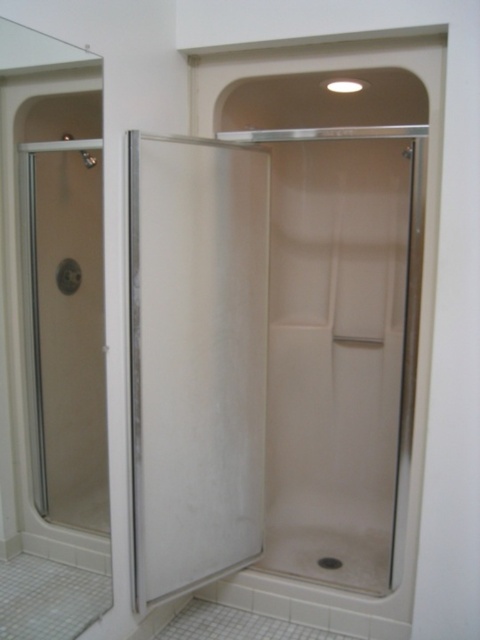
You are standing in the bathroom and see two points marked in the shower area. Which point is closer to you, point (259,212) or point (81,188)?

Point (81,188) is closer to you because it is less further to the viewer than point (259,212).

You are designing a bathroom layout and need to know the height differences between the transparent glass shower door at center and the clear glass shower door at left. Which one is taller?

The transparent glass shower door at center is much taller than the clear glass shower door at left according to the description.

You are designing a bathroom layout and need to place both the transparent glass shower door at center and the clear glass shower door at left. Which door requires more horizontal space for installation?

The transparent glass shower door at center requires more horizontal space for installation because its width surpasses that of the clear glass shower door at left.